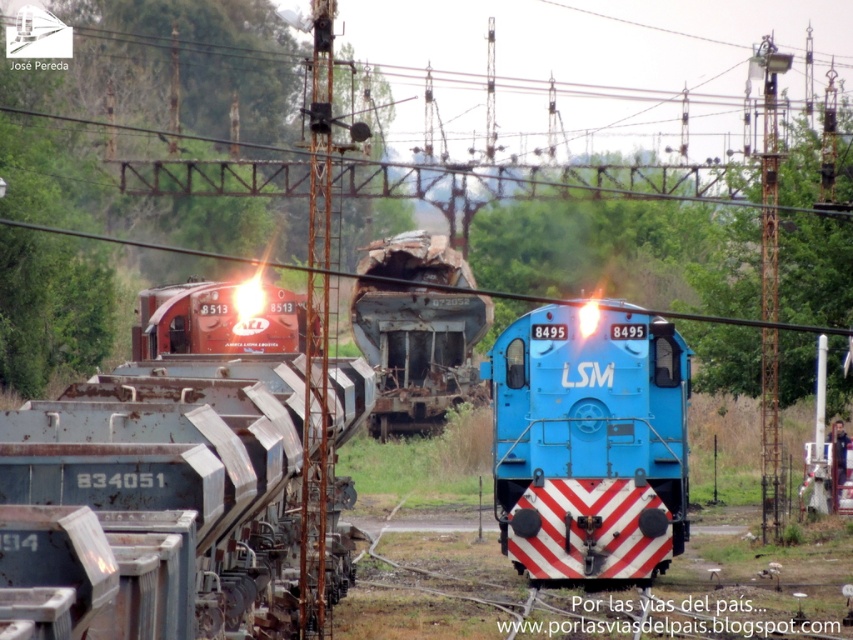
Is blue glossy locomotive at center closer to camera compared to rusty metal train car at center?

Yes, it is.

Who is taller, blue glossy locomotive at center or rusty metal train car at center?

rusty metal train car at center

Where is `blue glossy locomotive at center`? Image resolution: width=853 pixels, height=640 pixels. blue glossy locomotive at center is located at coordinates click(x=589, y=442).

Is rusty metal train car at center shorter than matte red locomotive at center?

Incorrect, rusty metal train car at center's height does not fall short of matte red locomotive at center's.

Which is below, rusty metal train car at center or matte red locomotive at center?

Positioned lower is matte red locomotive at center.

Which is behind, point (410, 296) or point (253, 324)?

The point (410, 296) is behind.

The image size is (853, 640). What are the coordinates of `rusty metal train car at center` in the screenshot? It's located at (416, 353).

Which is more to the right, blue glossy locomotive at center or matte red locomotive at center?

blue glossy locomotive at center is more to the right.

Is blue glossy locomotive at center to the right of matte red locomotive at center from the viewer's perspective?

Indeed, blue glossy locomotive at center is positioned on the right side of matte red locomotive at center.

The width and height of the screenshot is (853, 640). I want to click on blue glossy locomotive at center, so click(589, 442).

The height and width of the screenshot is (640, 853). Identify the location of blue glossy locomotive at center. (589, 442).